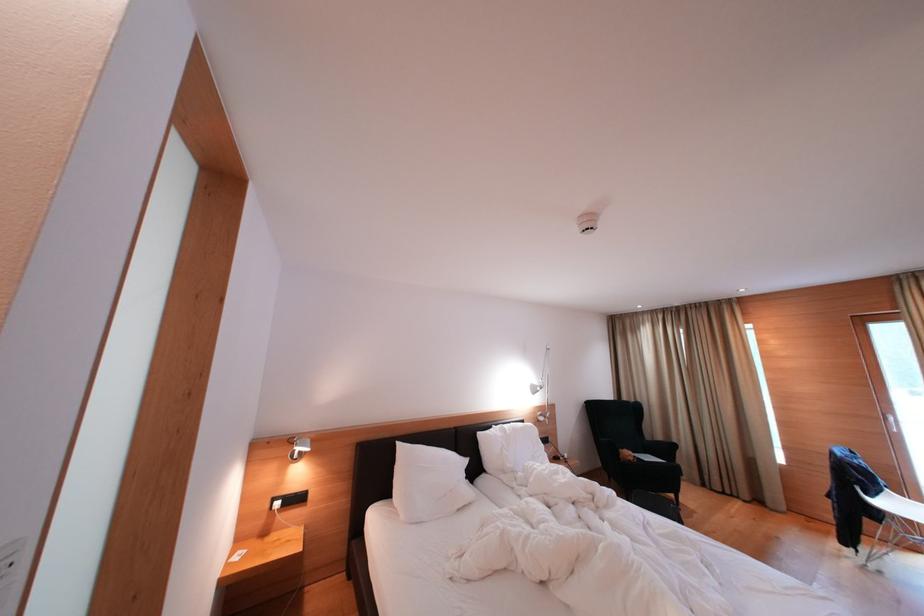
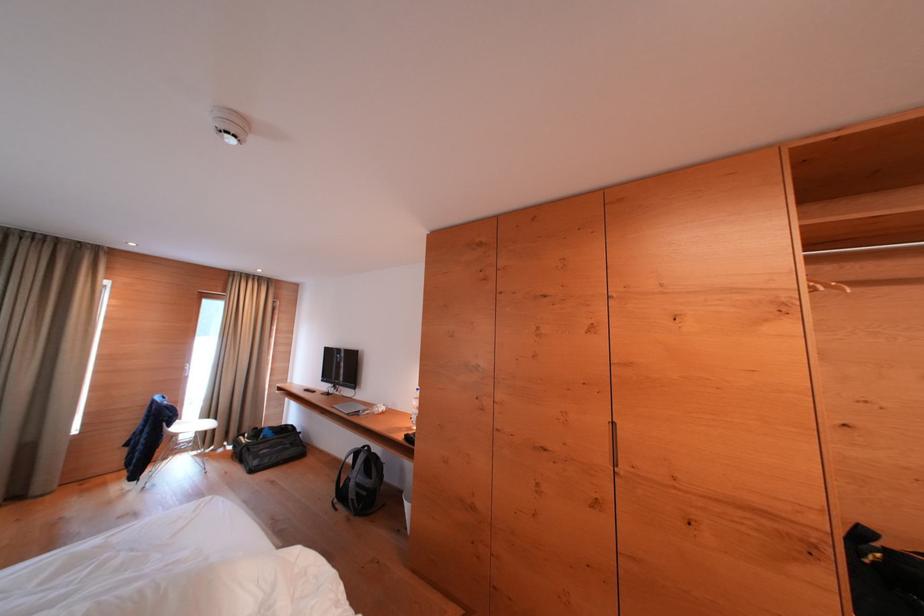
Question: The images are taken continuously from a first-person perspective. In which direction is your viewpoint rotating?

Choices:
 (A) Left
 (B) Right
 (C) Up
 (D) Down

Answer: (B)